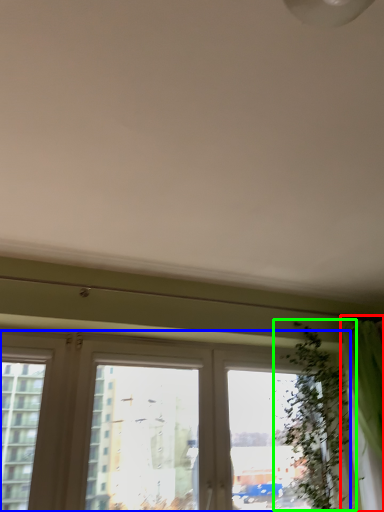
Question: Which is nearer to the curtain (highlighted by a red box)? window (highlighted by a blue box) or vegetation (highlighted by a green box).

Choices:
 (A) window
 (B) vegetation

Answer: (B)